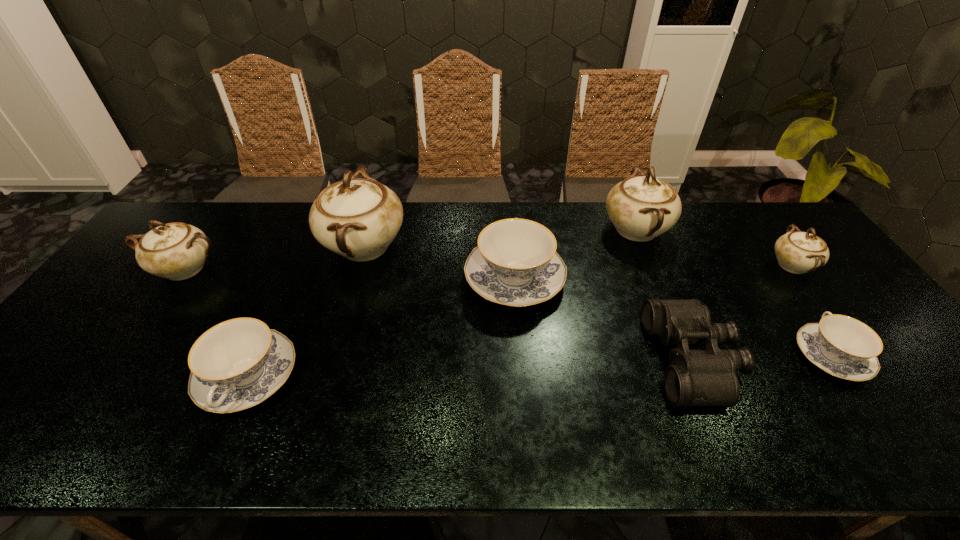
The height and width of the screenshot is (540, 960). Identify the location of the second shortest chinaware. (237, 364).

Where is `the leftmost blue chinaware`? The image size is (960, 540). the leftmost blue chinaware is located at coordinates (237, 364).

This screenshot has width=960, height=540. I want to click on the rightmost blue chinaware, so click(x=844, y=347).

Locate an element on the screen. Image resolution: width=960 pixels, height=540 pixels. the shortest object is located at coordinates (844, 347).

Locate an element on the screen. free point located on the right of the biggest white chinaware is located at coordinates [502, 246].

Find the location of a particular element. vacant space located 0.280m on the left of the sixth shortest chinaware is located at coordinates (516, 230).

This screenshot has height=540, width=960. I want to click on vacant region located on the front of the leftmost chinaware, so click(x=130, y=348).

This screenshot has width=960, height=540. Find the location of `free space located with the handle on the side of the biggest blue chinaware`. free space located with the handle on the side of the biggest blue chinaware is located at coordinates (511, 228).

The height and width of the screenshot is (540, 960). Find the location of `vacant area located with the handle on the side of the biggest blue chinaware`. vacant area located with the handle on the side of the biggest blue chinaware is located at coordinates (509, 210).

This screenshot has width=960, height=540. I want to click on vacant space located 0.170m with the handle on the side of the biggest blue chinaware, so click(x=509, y=214).